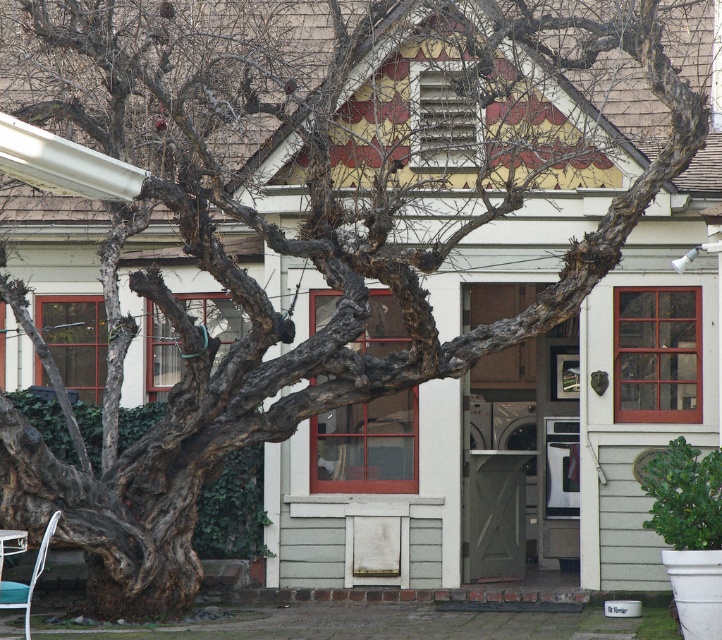
From the picture: You are sitting on the metallic white chair at lower left and want to take a photo of the dark brown rough bark at lower left. Since the bark is taller than the chair, will you need to tilt your camera upwards or downwards to capture the entire bark in the photo?

Since the dark brown rough bark at lower left is taller than the metallic white chair at lower left, you will need to tilt your camera upwards to capture the entire bark in the photo.

You are standing in front of the vintage house and notice two points marked on the ground. One is at point (139,500) and the other at point (43,556). Which point is closer to you?

Point (43,556) is closer to you because it is in front of point (139,500).